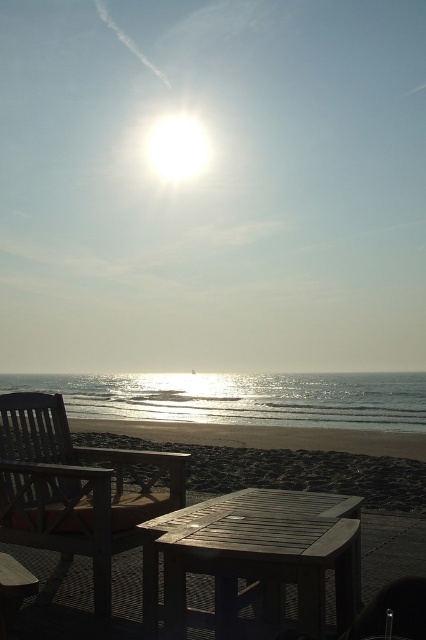
Question: Where is wooden slats chair at lower left located in relation to wooden table at center in the image?

Choices:
 (A) below
 (B) above

Answer: (B)

Question: Is wooden picnic table at center below shiny metallic water at lower center?

Choices:
 (A) yes
 (B) no

Answer: (B)

Question: Which point appears farthest from the camera in this image?

Choices:
 (A) (270, 410)
 (B) (400, 557)

Answer: (A)

Question: Which object is positioned farthest from the wooden picnic table at center?

Choices:
 (A) wooden slats chair at lower left
 (B) wooden table at center
 (C) shiny metallic water at lower center

Answer: (C)

Question: Does wooden slats chair at lower left have a greater width compared to wooden table at center?

Choices:
 (A) no
 (B) yes

Answer: (B)

Question: Which is nearer to the wooden table at center?

Choices:
 (A) shiny metallic water at lower center
 (B) wooden picnic table at center

Answer: (B)